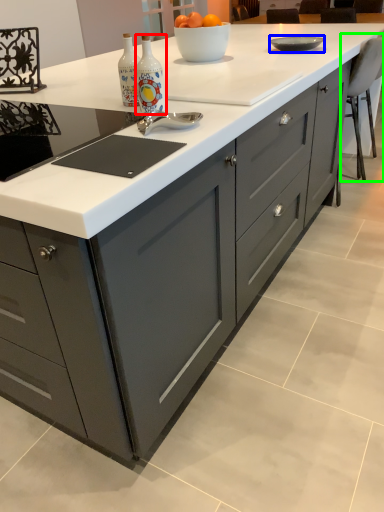
Question: Which object is the farthest from bottle (highlighted by a red box)? Choose among these: bowl (highlighted by a blue box) or chair (highlighted by a green box).

Choices:
 (A) bowl
 (B) chair

Answer: (B)